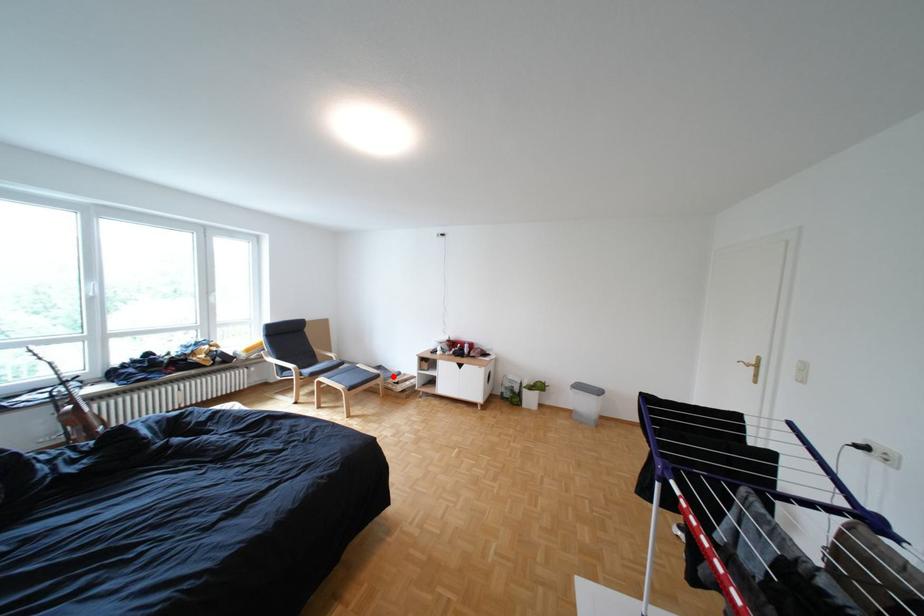
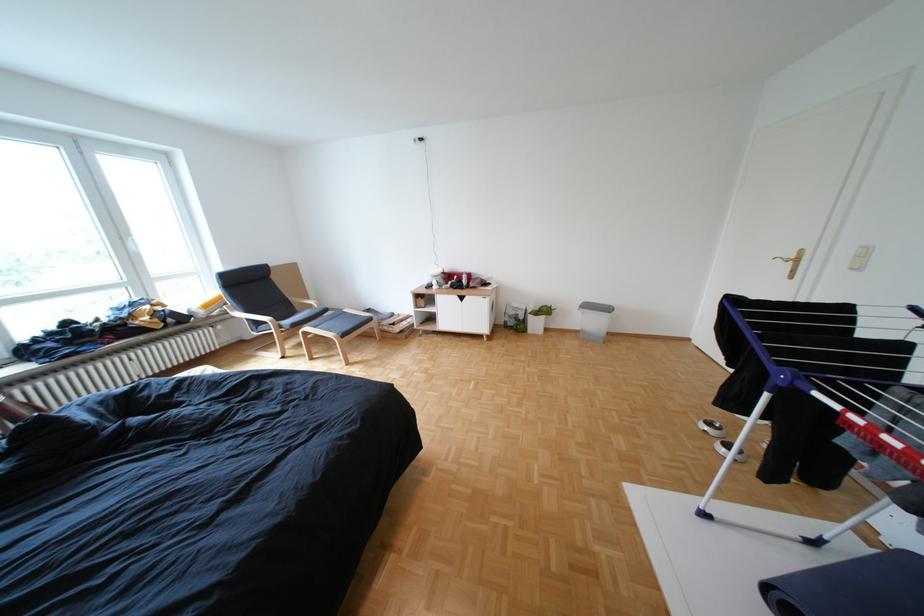
Question: I am providing you with two images of the same scene from different viewpoints. Image1 has a red point marked. In image2, the corresponding 3D location appears at what relative position? Reply with the corresponding letter.

Choices:
 (A) Closer
 (B) Farther

Answer: (A)